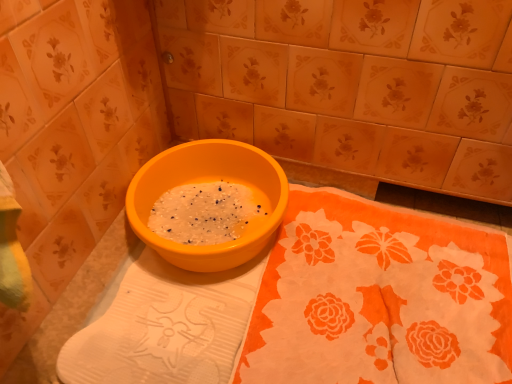
Question: Should I look upward or downward to see orange fabric at center?

Choices:
 (A) up
 (B) down

Answer: (B)

Question: Can you confirm if matte ceramic tile at center is positioned to the left of matte plastic basin at center?

Choices:
 (A) no
 (B) yes

Answer: (A)

Question: Can you see matte ceramic tile at center touching matte plastic basin at center?

Choices:
 (A) no
 (B) yes

Answer: (A)

Question: Is matte ceramic tile at center outside of matte plastic basin at center?

Choices:
 (A) no
 (B) yes

Answer: (B)

Question: Can matte plastic basin at center be found inside matte ceramic tile at center?

Choices:
 (A) yes
 (B) no

Answer: (B)

Question: Are matte ceramic tile at center and matte plastic basin at center located far from each other?

Choices:
 (A) no
 (B) yes

Answer: (A)

Question: Is matte ceramic tile at center at the right side of matte plastic basin at center?

Choices:
 (A) no
 (B) yes

Answer: (B)

Question: From a real-world perspective, is matte ceramic tile at center on orange fabric at center?

Choices:
 (A) yes
 (B) no

Answer: (A)

Question: From a real-world perspective, is matte ceramic tile at center under orange fabric at center?

Choices:
 (A) yes
 (B) no

Answer: (B)

Question: Is orange fabric at center inside matte ceramic tile at center?

Choices:
 (A) yes
 (B) no

Answer: (B)

Question: Considering the relative sizes of matte ceramic tile at center and orange fabric at center in the image provided, is matte ceramic tile at center taller than orange fabric at center?

Choices:
 (A) yes
 (B) no

Answer: (A)

Question: Is matte ceramic tile at center next to orange fabric at center and touching it?

Choices:
 (A) no
 (B) yes

Answer: (A)

Question: Considering the relative sizes of matte ceramic tile at center and orange fabric at center in the image provided, is matte ceramic tile at center wider than orange fabric at center?

Choices:
 (A) no
 (B) yes

Answer: (B)

Question: From the image's perspective, is orange fabric at center under matte plastic basin at center?

Choices:
 (A) yes
 (B) no

Answer: (A)